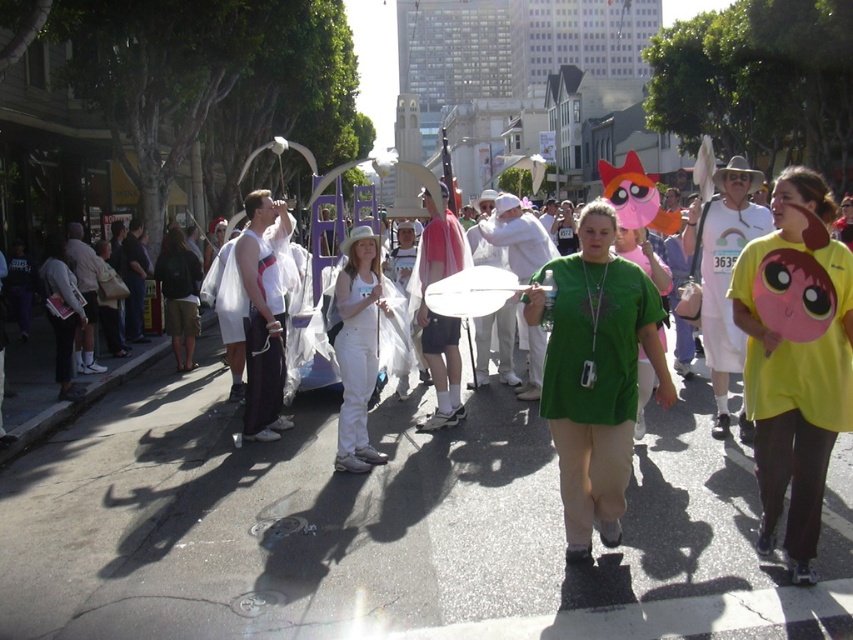
Please look at the point at coordinates (x=381, y=513). What object is located there?

The green fabric balloon at center is located at point (x=381, y=513).

You are standing in the middle of the street and want to take a photo of both the point at coordinates point [323,401] and point [370,298]. Which point should you focus on first to ensure both are in focus?

You should focus on point [323,401] first because it is closer to the camera than point [370,298]. This ensures that both points will be in focus as the depth of field will cover the distance between them.